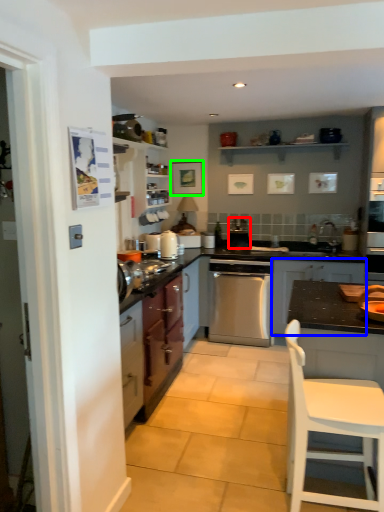
Question: Which is farther away from appliance (highlighted by a red box)? cabinetry (highlighted by a blue box) or picture frame (highlighted by a green box)?

Choices:
 (A) cabinetry
 (B) picture frame

Answer: (A)